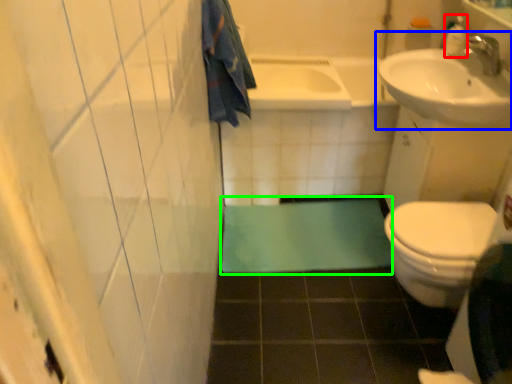
Question: Which object is positioned closest to toiletry (highlighted by a red box)? Select from sink (highlighted by a blue box) and bath mat (highlighted by a green box).

Choices:
 (A) sink
 (B) bath mat

Answer: (A)